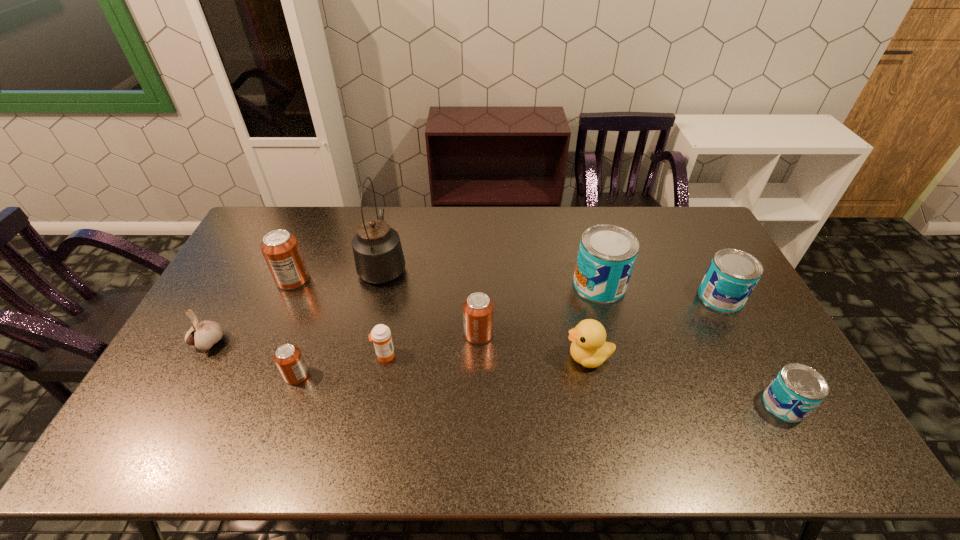
Where is `kettle`? kettle is located at coordinates (378, 254).

Find the location of a particular element. The image size is (960, 540). the leftmost blue can is located at coordinates (607, 253).

The width and height of the screenshot is (960, 540). I want to click on the fourth can from left to right, so click(x=607, y=253).

Find the location of a particular element. The image size is (960, 540). the second object from left to right is located at coordinates (282, 253).

Where is `the biggest orange can`? the biggest orange can is located at coordinates (x=282, y=253).

Identify the location of the second biggest orange can. The image size is (960, 540). (478, 309).

In order to click on the rightmost orange can in this screenshot , I will do `click(478, 309)`.

The height and width of the screenshot is (540, 960). What are the coordinates of `the second smallest blue can` in the screenshot? It's located at (732, 275).

Locate an element on the screen. The image size is (960, 540). yellow duck is located at coordinates (588, 348).

Find the location of `orange medicine`. orange medicine is located at coordinates (380, 335).